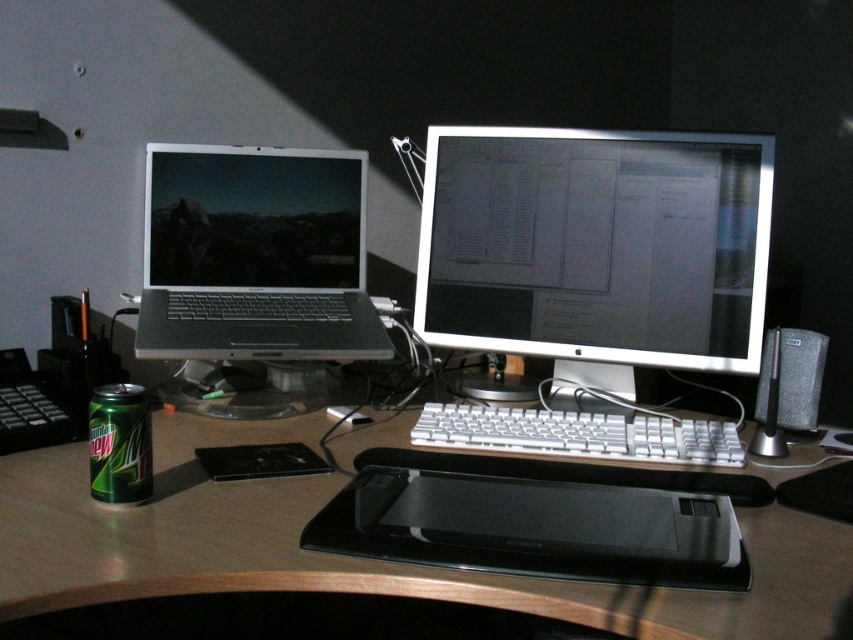
Question: Is black plastic drawing tablet at center thinner than white plastic keyboard at center?

Choices:
 (A) yes
 (B) no

Answer: (B)

Question: Can you confirm if satin silver laptop at left is positioned to the left of green matte can at lower left?

Choices:
 (A) no
 (B) yes

Answer: (A)

Question: Which of these objects is positioned closest to the white plastic keyboard at center?

Choices:
 (A) brown wood table at center
 (B) black matte speaker at right
 (C) satin silver monitor at center

Answer: (B)

Question: Which is nearer to the satin silver monitor at center?

Choices:
 (A) satin silver laptop at left
 (B) black plastic drawing tablet at center
 (C) green matte can at lower left

Answer: (A)

Question: Which point appears farthest from the camera in this image?

Choices:
 (A) (389, 481)
 (B) (567, 269)
 (C) (213, 170)

Answer: (C)

Question: Can you confirm if satin silver laptop at left is smaller than green matte can at lower left?

Choices:
 (A) no
 (B) yes

Answer: (A)